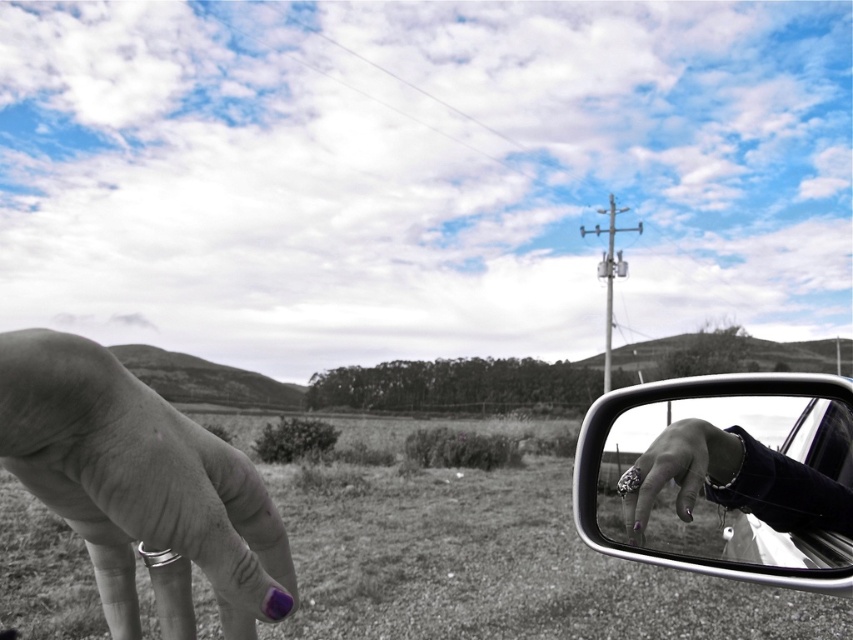
Between black leather glove at right and polished silver ring at lower right, which one appears on the left side from the viewer's perspective?

polished silver ring at lower right

Is black leather glove at right wider than polished silver ring at lower right?

Yes.

This screenshot has width=853, height=640. Identify the location of black leather glove at right. (793, 492).

Locate an element on the screen. black leather glove at right is located at coordinates (793, 492).

Is point (141, 465) behind point (793, 568)?

No, it is not.

Where is `purple painted fingernail at center`? This screenshot has width=853, height=640. purple painted fingernail at center is located at coordinates (140, 486).

Between purple painted fingernail at center and black leather glove at right, which one has less height?

With less height is purple painted fingernail at center.

Who is positioned more to the left, purple painted fingernail at center or black leather glove at right?

purple painted fingernail at center is more to the left.

The width and height of the screenshot is (853, 640). Find the location of `purple painted fingernail at center`. purple painted fingernail at center is located at coordinates (140, 486).